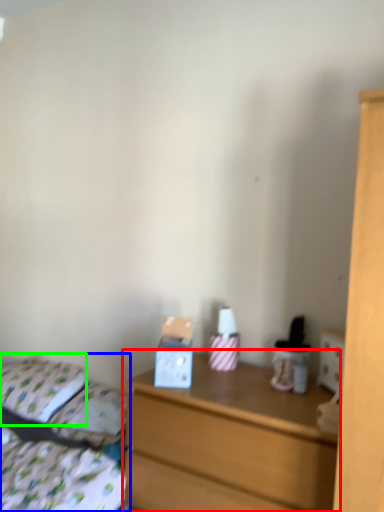
Question: Which object is the closest to the chest of drawers (highlighted by a red box)? Choose among these: bed (highlighted by a blue box) or pillow (highlighted by a green box).

Choices:
 (A) bed
 (B) pillow

Answer: (A)